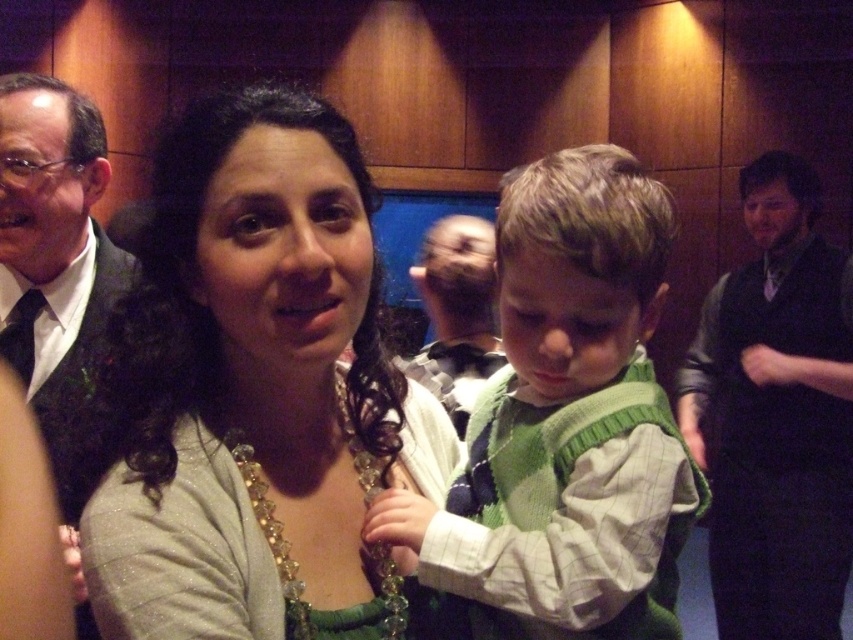
You are a photographer at the event and want to capture a clear shot of the crystal glass necklace at center without the green knit sweater at center blocking it. How should you adjust your camera angle?

The crystal glass necklace at center is behind the green knit sweater at center, so you should move your camera angle slightly forward or to the side to avoid the obstruction caused by the sweater.

You are a photographer at a formal event. You notice the crystal glass necklace at center and the black satin tie at left in your frame. Which object is closer to the camera?

The crystal glass necklace at center is closer to the camera because it is in front of the black satin tie at left.

You are a photographer at the event and want to capture a closeup of the crystal glass necklace at center without the green knit sweater at center appearing in the frame. Is this possible given their positions?

The green knit sweater at center is positioned on the right side of the crystal glass necklace at center, so moving the camera slightly to the left of the necklace would exclude the sweater from the frame.